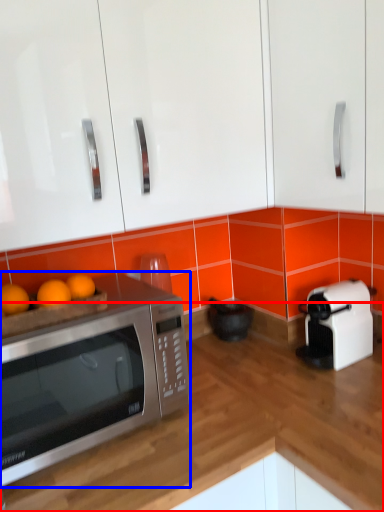
Question: Which point is closer to the camera, counter top (highlighted by a red box) or microwave oven (highlighted by a blue box)?

Choices:
 (A) counter top
 (B) microwave oven

Answer: (A)